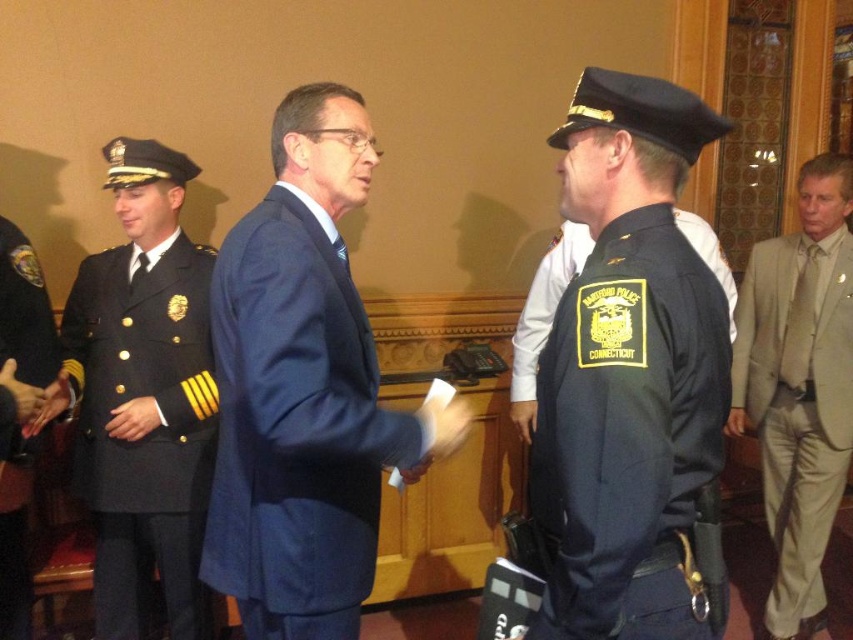
Question: Can you confirm if navy blue suit at center is positioned to the left of dark blue fabric uniform at left?

Choices:
 (A) no
 (B) yes

Answer: (A)

Question: Which point appears closest to the camera in this image?

Choices:
 (A) (265, 548)
 (B) (805, 317)

Answer: (A)

Question: Which of the following is the closest to the observer?

Choices:
 (A) black uniform at left
 (B) dark blue fabric uniform at left

Answer: (A)

Question: Is navy blue suit at center bigger than dark blue fabric uniform at left?

Choices:
 (A) no
 (B) yes

Answer: (B)

Question: Is the position of navy blue fabric uniform at center less distant than that of black uniform at left?

Choices:
 (A) no
 (B) yes

Answer: (B)

Question: Which object is closer to the camera taking this photo?

Choices:
 (A) navy blue suit at center
 (B) light beige fabric suit at right
 (C) dark blue fabric uniform at left
 (D) black uniform at left

Answer: (A)